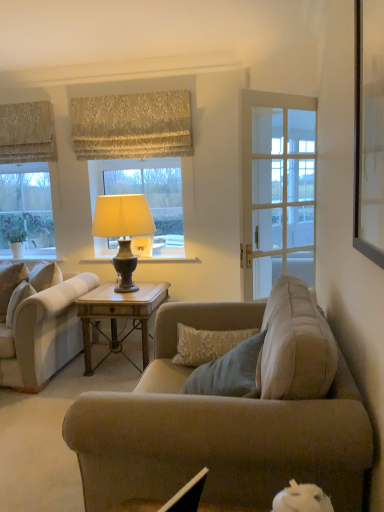
At what (x,y) coordinates should I click in order to perform the action: click on free space above gold textured fabric at upper center, the 1th curtain viewed from the right (from a real-world perspective). Please return your answer as a coordinate pair (x, y). Looking at the image, I should click on (125, 93).